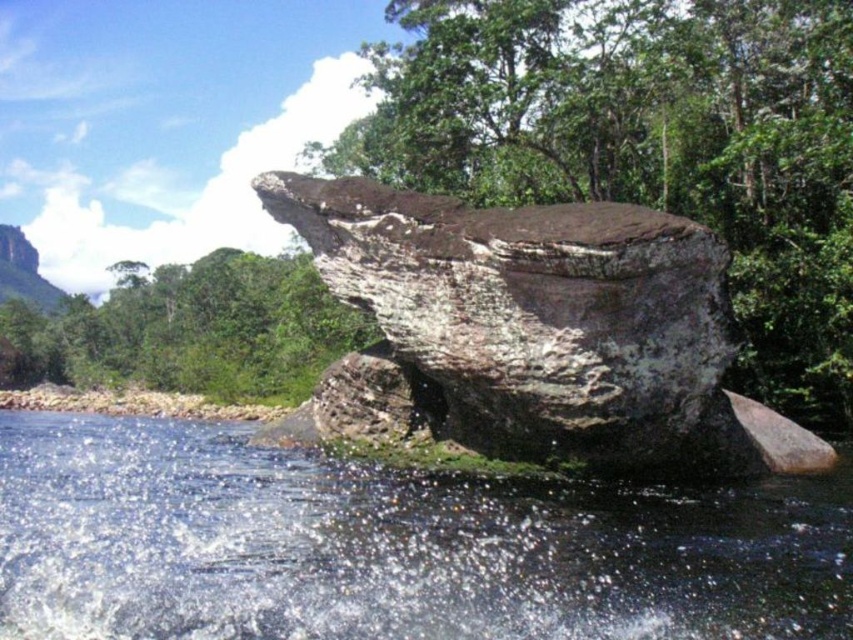
You are a hiker who wants to cross the river using the rock. Given that the clear water at center is flowing around the brown rough rock at center, can you step onto the rock without getting your feet wet?

The clear water at center has a smaller size compared to brown rough rock at center, so the rock is larger than the water area around it. Therefore, you can step onto the brown rough rock at center without getting your feet wet as most of its surface is above the water.

You are standing on the bank of the river and want to cross to the other side. You see the clear water at center and the brown rough rock at center. Which object is located above the other?

The brown rough rock at center is positioned above the clear water at center, so you can step onto the brown rough rock at center to cross the river safely.

You are standing on the bank of the river and want to cross to the other side. The clear water at center flows around the brown rough rock at center. Which path would allow you to cross the river without getting your feet wet?

The clear water at center is wider than the brown rough rock at center. To cross without getting wet, you should walk over the brown rough rock at center since it is narrower and offers a dry path.